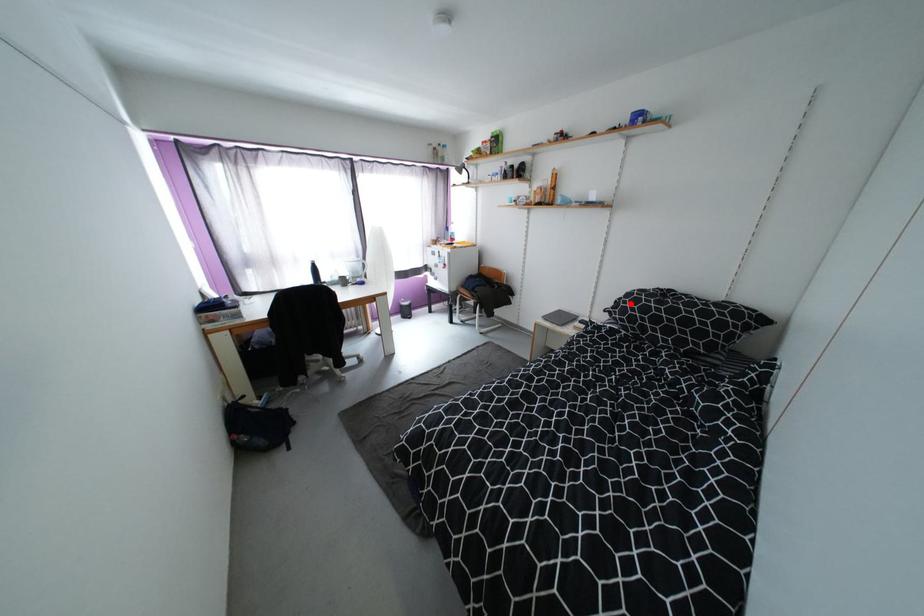
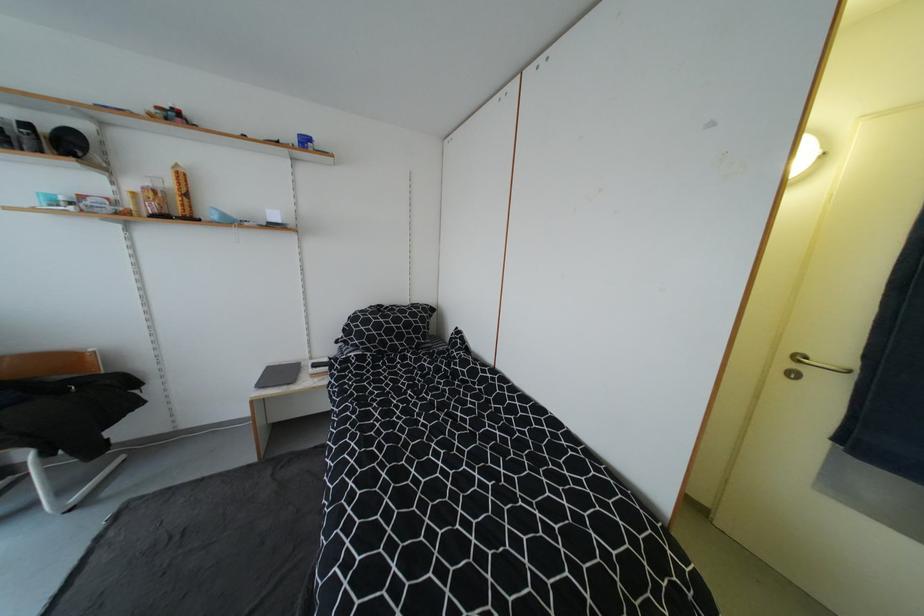
Where in the second image is the point corresponding to the highlighted location from the first image?

(362, 328)